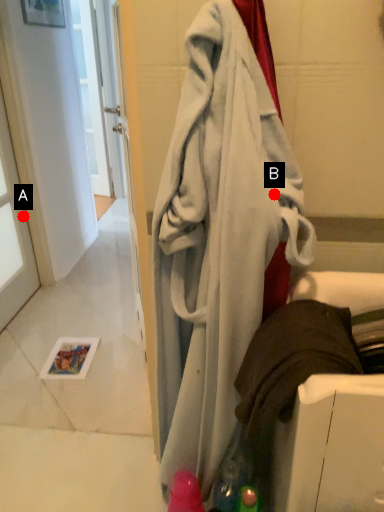
Question: Two points are circled on the image, labeled by A and B beside each circle. Which point is closer to the camera?

Choices:
 (A) A is closer
 (B) B is closer

Answer: (B)